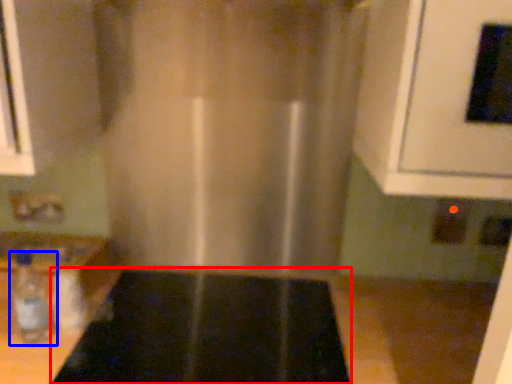
Question: Which point is further to the camera, appliance (highlighted by a red box) or bottle (highlighted by a blue box)?

Choices:
 (A) appliance
 (B) bottle

Answer: (B)